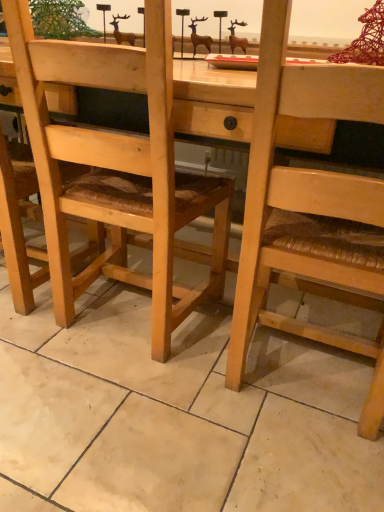
Locate an element on the screen. This screenshot has width=384, height=512. vacant region in front of natural wood chair at center, which is the second chair from left to right is located at coordinates (276, 468).